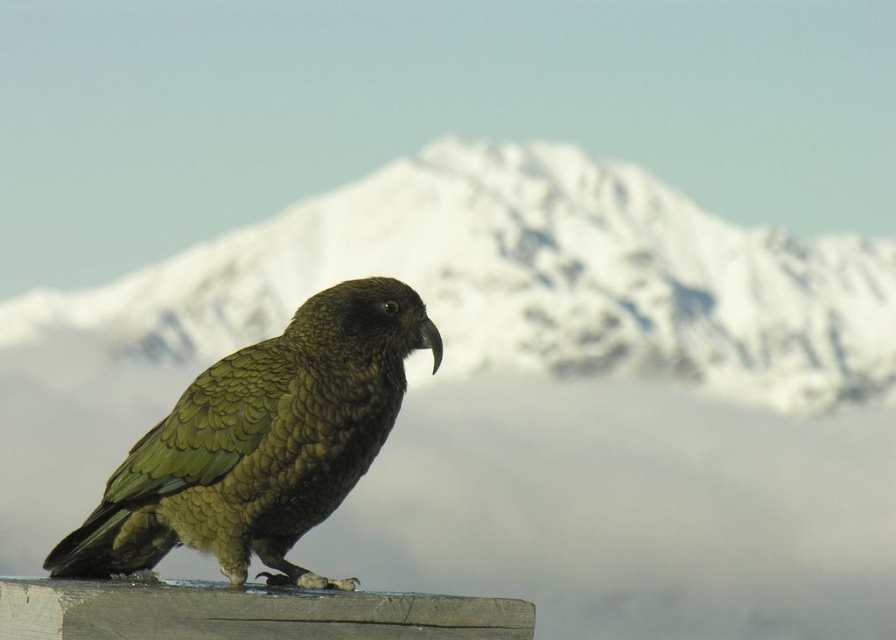
You are a photographer trying to capture the snowy mountain at upper center and the green scaly parrot at center in one frame. Which object should you focus on first if you want to ensure both are in focus?

The snowy mountain at upper center is larger than the green scaly parrot at center, so focusing on the larger object first will help ensure both are in focus.

You are a photographer trying to capture the bird on the wooden surface. You notice two points in the image labeled as point 1 at (751, 243) and point 2 at (369, 304). Which point is closer to your camera lens?

Point 1 at (751, 243) is further to the camera than point 2 at (369, 304). Therefore, point 2 at (369, 304) is closer to the camera lens.